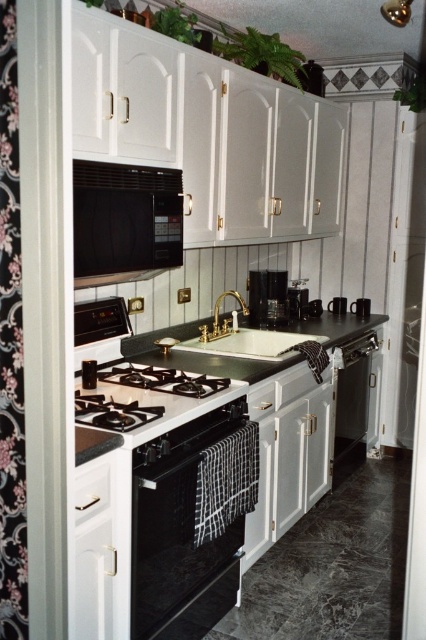
Question: Is green granite countertop at center below black matte coffee maker at center?

Choices:
 (A) yes
 (B) no

Answer: (A)

Question: Can you confirm if white matte drawer at lower left is wider than black matte coffee pot at center?

Choices:
 (A) yes
 (B) no

Answer: (B)

Question: Which of the following is the closest to the observer?

Choices:
 (A) (9, 168)
 (B) (80, 508)
 (C) (115, 419)

Answer: (A)

Question: Which is farther from the black matte coffee pot at center?

Choices:
 (A) black matte coffee maker at center
 (B) green granite countertop at center

Answer: (B)

Question: Is satin silver dishwasher at lower center above white matte drawer at lower left?

Choices:
 (A) no
 (B) yes

Answer: (A)

Question: Which of these objects is positioned farthest from the white matte drawer at lower left?

Choices:
 (A) stainless steel gas stove at center
 (B) black matte coffee maker at center

Answer: (B)